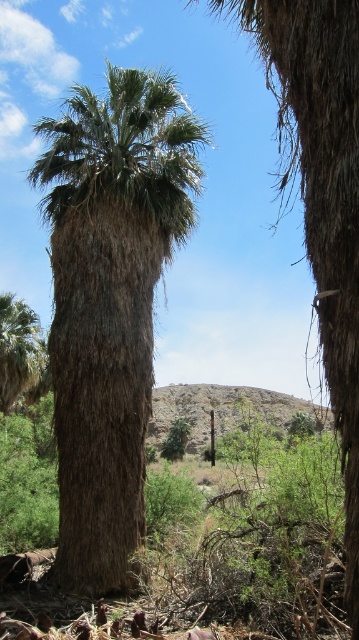
Which of these two, brown textured palm tree at center or green leafy palm tree at lower left, stands taller?

brown textured palm tree at center

Does point (145, 323) come farther from viewer compared to point (2, 332)?

No, (145, 323) is in front of (2, 332).

Between point (76, 308) and point (33, 346), which one is positioned behind?

Point (33, 346)

Identify the location of brown textured palm tree at center. (109, 301).